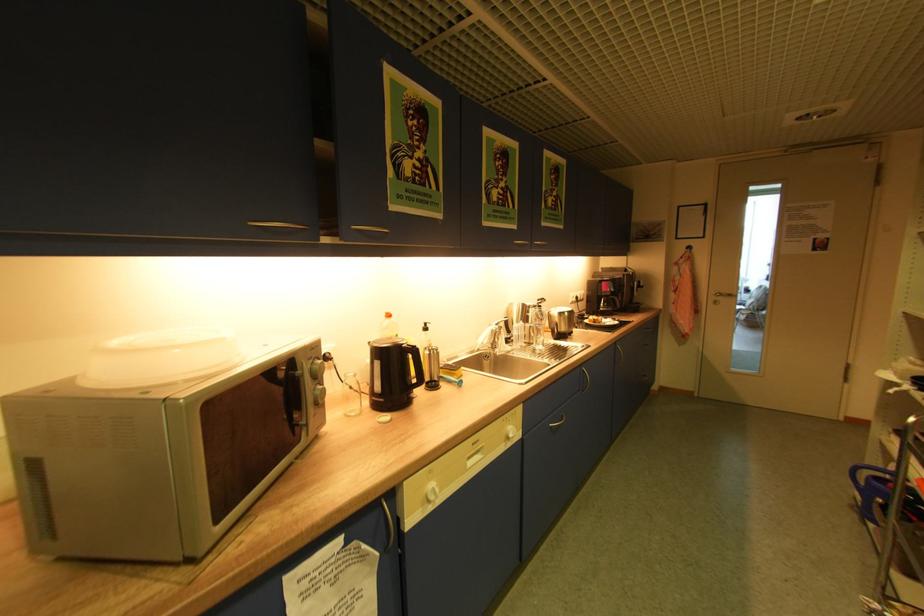
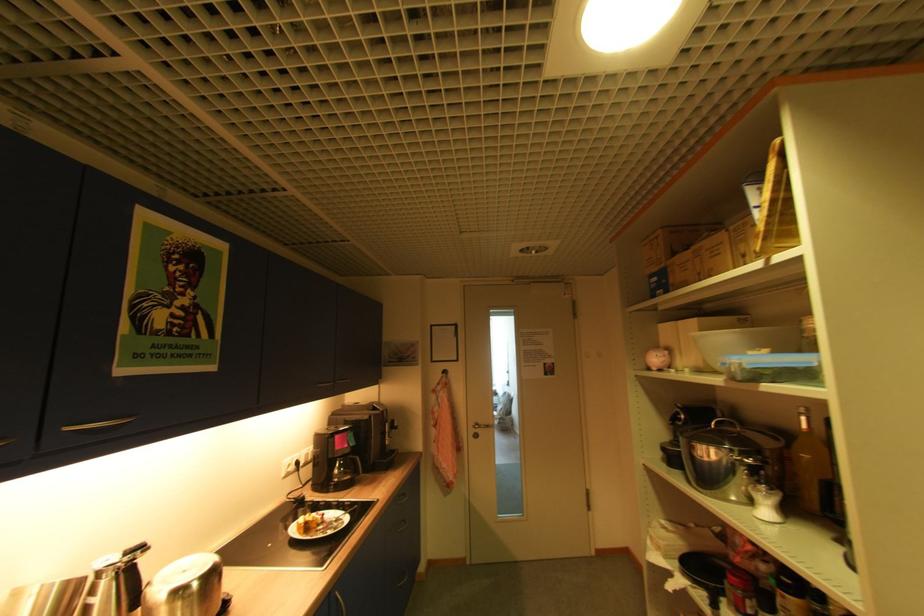
The point at (x=609, y=284) is marked in the first image. Where is the corresponding point in the second image?

(343, 437)